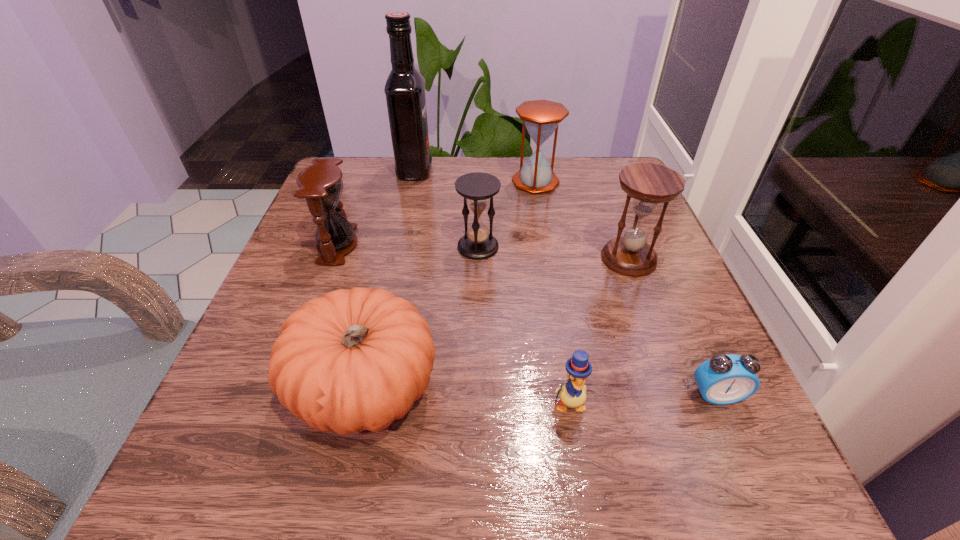
This screenshot has width=960, height=540. In order to click on liquor in this screenshot , I will do `click(405, 87)`.

Where is `the rightmost hourglass`? the rightmost hourglass is located at coordinates (648, 184).

At what (x,y) coordinates should I click in order to perform the action: click on the farthest hourglass. Please return your answer as a coordinate pair (x, y). This screenshot has width=960, height=540. Looking at the image, I should click on (541, 118).

The height and width of the screenshot is (540, 960). Identify the location of the leftmost hourglass. (321, 185).

Where is `the second hourglass from left to right`? the second hourglass from left to right is located at coordinates (477, 188).

This screenshot has height=540, width=960. I want to click on pumpkin, so click(351, 360).

Where is `duckling`? The width and height of the screenshot is (960, 540). duckling is located at coordinates (573, 394).

Find the location of a particular element. The image size is (960, 540). the shortest object is located at coordinates (724, 379).

Find the location of a particular element. This screenshot has width=960, height=540. vacant region located on the front-facing side of the liquor is located at coordinates (591, 171).

Locate an element on the screen. The height and width of the screenshot is (540, 960). vacant space situated on the left of the rightmost hourglass is located at coordinates (421, 259).